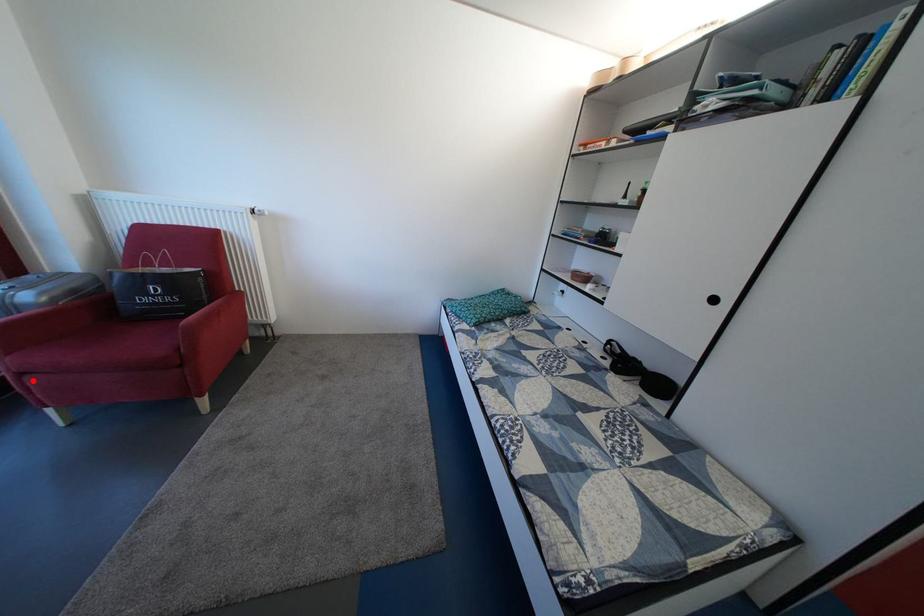
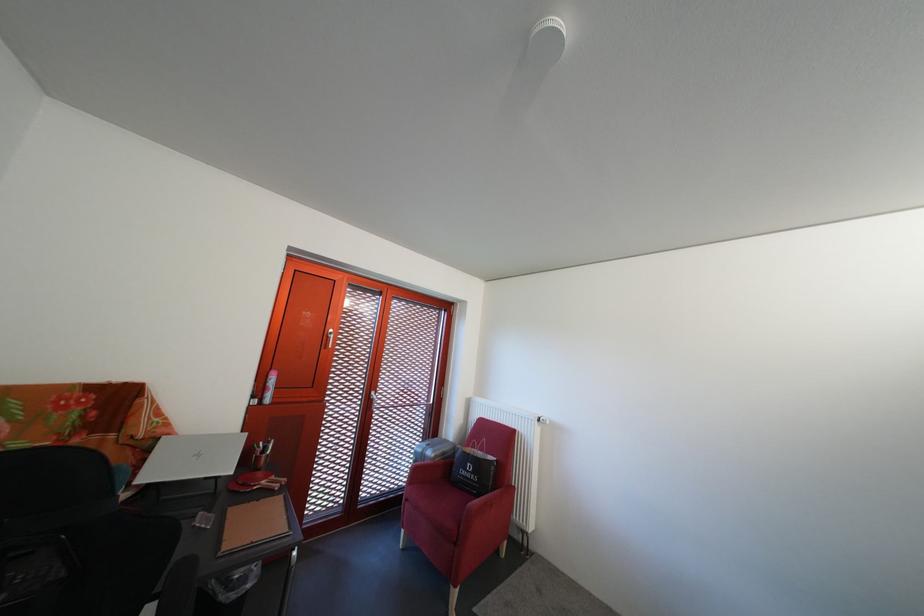
Locate, in the second image, the point that corresponds to the highlighted location in the first image.

(418, 507)